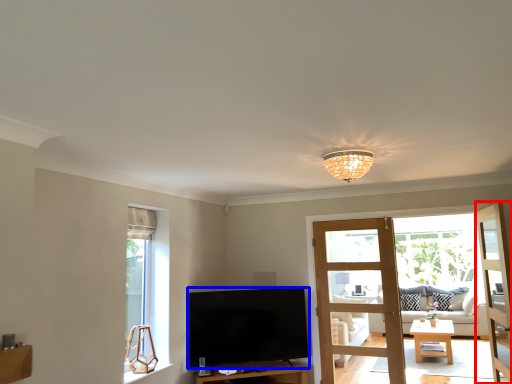
Question: Which object appears closest to the camera in this image, door (highlighted by a red box) or television (highlighted by a blue box)?

Choices:
 (A) door
 (B) television

Answer: (A)